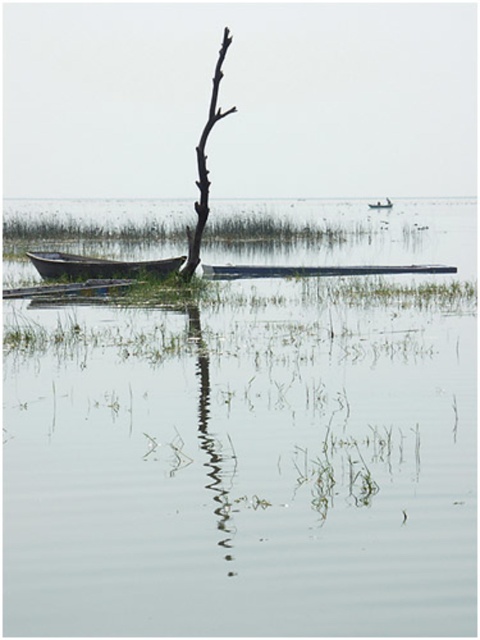
Question: Does wooden canoe at lower left have a smaller size compared to wooden boat at center?

Choices:
 (A) yes
 (B) no

Answer: (A)

Question: Can you confirm if smooth brown tree trunk at center is thinner than smooth wood canoe at center?

Choices:
 (A) yes
 (B) no

Answer: (A)

Question: Which point is closer to the camera?

Choices:
 (A) smooth wood canoe at center
 (B) clear water at center
 (C) wooden canoe at left

Answer: (B)

Question: Which object is the closest to the wooden boat at center?

Choices:
 (A) clear water at center
 (B) smooth wood canoe at center
 (C) wooden canoe at left
 (D) smooth brown tree trunk at center

Answer: (A)

Question: Which of the following is the closest to the observer?

Choices:
 (A) wooden canoe at lower left
 (B) wooden boat at center
 (C) smooth brown tree trunk at center

Answer: (A)

Question: Can you confirm if smooth wood canoe at center is thinner than wooden boat at center?

Choices:
 (A) yes
 (B) no

Answer: (A)